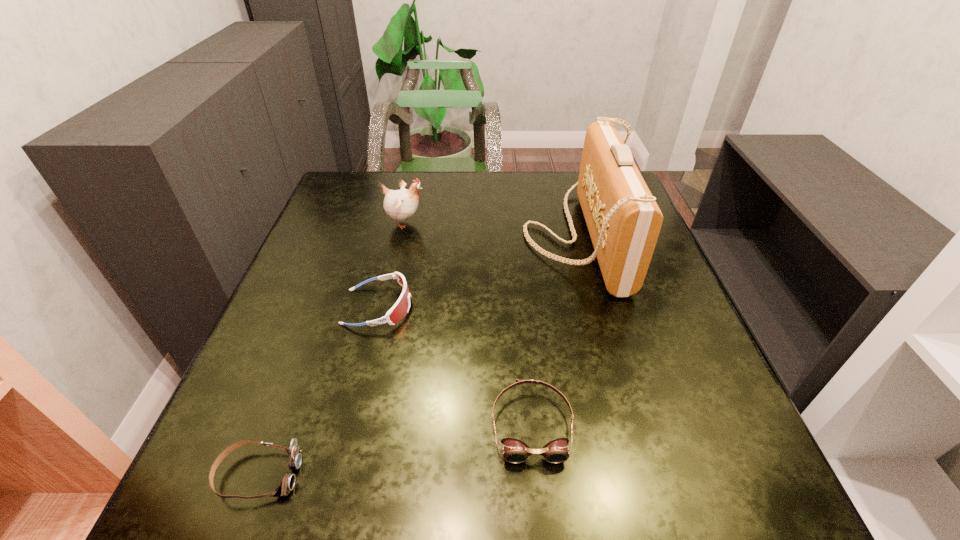
Find the location of a particular element. handbag is located at coordinates (623, 219).

Identify the location of the second tallest object. (401, 204).

The image size is (960, 540). I want to click on the farthest goggles, so click(x=399, y=310).

You are a GUI agent. You are given a task and a screenshot of the screen. Output one action in this format:
    pyautogui.click(x=<x>, y=<y>)
    Task: Click on the tallest goggles
    The width and height of the screenshot is (960, 540).
    Given the screenshot: What is the action you would take?
    pyautogui.click(x=399, y=310)

At what (x,y) coordinates should I click in order to perform the action: click on the rightmost goggles. Please return your answer as a coordinate pair (x, y). The height and width of the screenshot is (540, 960). Looking at the image, I should click on (515, 451).

At what (x,y) coordinates should I click in order to perform the action: click on vacant space positioned on the decorative side of the tallest object. Please return your answer as a coordinate pair (x, y). This screenshot has width=960, height=540. Looking at the image, I should click on [x=375, y=235].

The image size is (960, 540). What are the coordinates of `vacant space situated 0.200m on the decorative side of the tallest object` in the screenshot? It's located at (445, 235).

You are a GUI agent. You are given a task and a screenshot of the screen. Output one action in this format:
    pyautogui.click(x=<x>, y=<y>)
    Task: Click on the vacant area situated 0.250m on the decorative side of the tallest object
    
    Given the screenshot: What is the action you would take?
    pyautogui.click(x=426, y=235)

Where is `free space located at the beak of the bird`? The height and width of the screenshot is (540, 960). free space located at the beak of the bird is located at coordinates (474, 222).

This screenshot has width=960, height=540. I want to click on vacant space located on the front-facing side of the tallest goggles, so click(x=589, y=307).